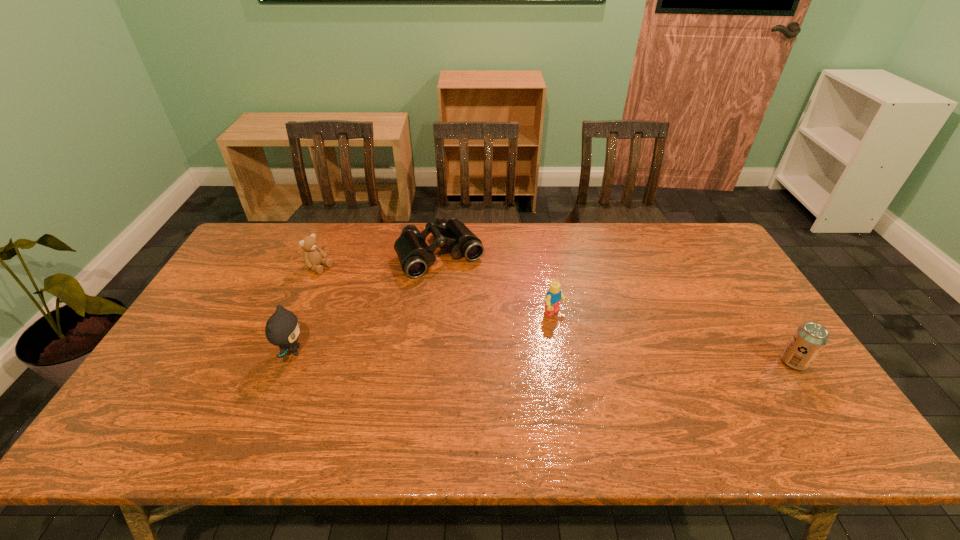
Identify the location of free space between the rightmost object and the third object from right to left. (616, 308).

This screenshot has width=960, height=540. I want to click on unoccupied position between the beer can and the third farthest object, so click(x=674, y=338).

Find the location of `free space between the beer can and the teddy bear`. free space between the beer can and the teddy bear is located at coordinates (557, 315).

The image size is (960, 540). What are the coordinates of `vacant area that lies between the Lego and the beer can` in the screenshot? It's located at (674, 338).

I want to click on vacant space in between the kitten and the rightmost object, so click(x=543, y=357).

Find the location of a particular element. The height and width of the screenshot is (540, 960). vacant area that lies between the second object from right to left and the kitten is located at coordinates (423, 333).

Identify the location of the closest object relative to the third object from left to right. (313, 256).

Point out which object is positioned as the nearest to the beer can. Please provide its 2D coordinates. Your answer should be formatted as a tuple, i.e. [(x, y)], where the tuple contains the x and y coordinates of a point satisfying the conditions above.

[(553, 297)]

Image resolution: width=960 pixels, height=540 pixels. What are the coordinates of `free spot that satisfies the following two spatial constraints: 1. on the front side of the binoculars; 2. on the right side of the rightmost object` in the screenshot? It's located at (428, 362).

The height and width of the screenshot is (540, 960). Find the location of `vacant point that satisfies the following two spatial constraints: 1. on the back side of the third object from right to left; 2. on the right side of the teddy bear`. vacant point that satisfies the following two spatial constraints: 1. on the back side of the third object from right to left; 2. on the right side of the teddy bear is located at coordinates (325, 254).